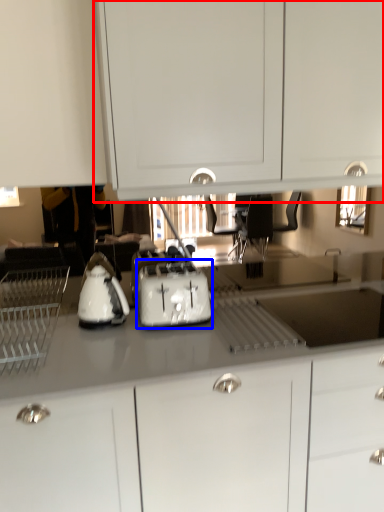
Question: Among these objects, which one is nearest to the camera, cabinetry (highlighted by a red box) or toaster (highlighted by a blue box)?

Choices:
 (A) cabinetry
 (B) toaster

Answer: (A)